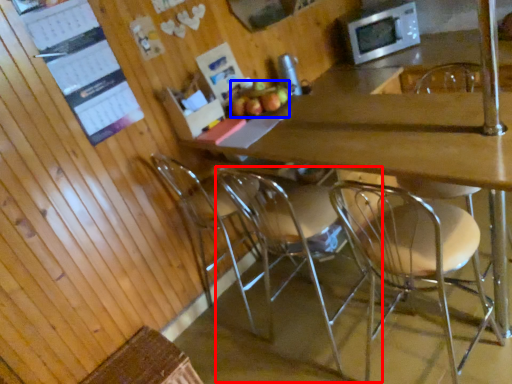
Question: Which point is closer to the camera, chair (highlighted by a red box) or apple (highlighted by a blue box)?

Choices:
 (A) chair
 (B) apple

Answer: (A)